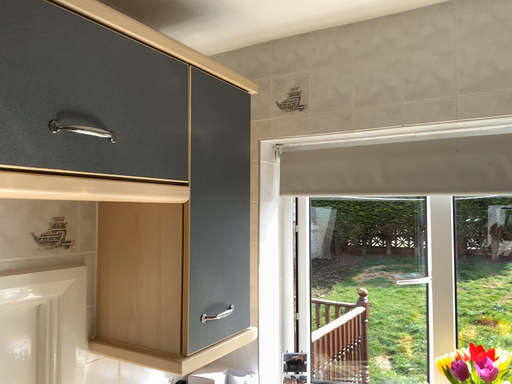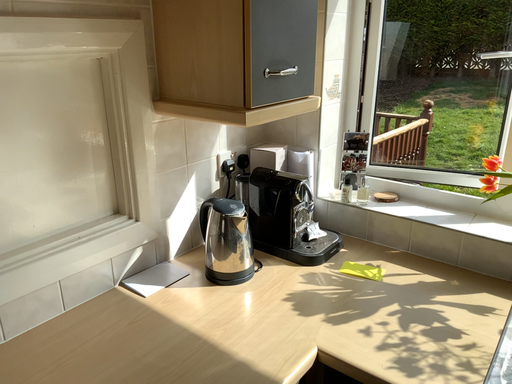
Question: Which way did the camera rotate in the video?

Choices:
 (A) rotated downward
 (B) rotated upward

Answer: (A)